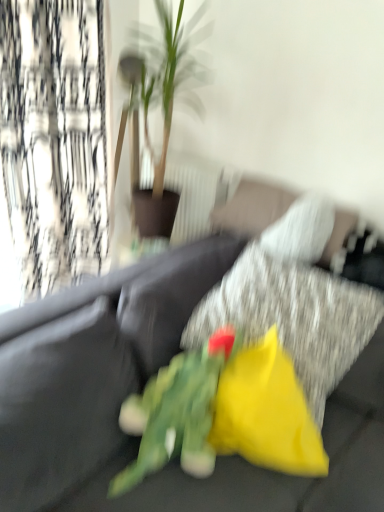
Question: Looking at their shapes, would you say green leafy plant at center is wider or thinner than black textured curtain at left?

Choices:
 (A) wide
 (B) thin

Answer: (A)

Question: From their relative heights in the image, would you say green leafy plant at center is taller or shorter than black textured curtain at left?

Choices:
 (A) short
 (B) tall

Answer: (A)

Question: Based on their relative distances, which object is farther from the black textured curtain at left?

Choices:
 (A) green leafy plant at center
 (B) green fabric flower at center
 (C) yellow fabric pillow at center
 (D) velvet dark gray couch at center
 (E) yellow fabric flower at center

Answer: (E)

Question: Considering the real-world distances, which object is closest to the green fabric flower at center?

Choices:
 (A) yellow fabric flower at center
 (B) yellow fabric pillow at center
 (C) velvet dark gray couch at center
 (D) green leafy plant at center
 (E) black textured curtain at left

Answer: (A)